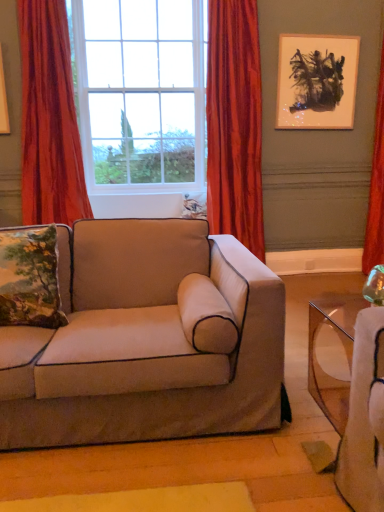
Measure the distance between point (381, 89) and camera.

They are 3.75 meters apart.

I want to click on red velvet curtain at right, the third curtain positioned from the left, so click(376, 188).

Is velvet orange curtain at left, which is the 3th curtain in right-to-left order, oriented away from velvet-like red curtain at center, which is the 2th curtain from right to left?

No, velvet orange curtain at left, which is the 3th curtain in right-to-left order, is not facing the opposite direction of velvet-like red curtain at center, which is the 2th curtain from right to left.

Considering the positions of objects velvet orange curtain at left, which is the 3th curtain in right-to-left order, and velvet-like red curtain at center, which is the 2th curtain from right to left, in the image provided, who is behind, velvet orange curtain at left, which is the 3th curtain in right-to-left order, or velvet-like red curtain at center, which is the 2th curtain from right to left,?

velvet-like red curtain at center, which is the 2th curtain from right to left, is further away from the camera.

Consider the image. From a real-world perspective, does velvet orange curtain at left, the 1th curtain positioned from the left, stand above velvet-like red curtain at center, positioned as the second curtain in left-to-right order?

Indeed, from a real-world perspective, velvet orange curtain at left, the 1th curtain positioned from the left, stands above velvet-like red curtain at center, positioned as the second curtain in left-to-right order.

Does red velvet curtain at right, the third curtain positioned from the left, turn towards velvet orange curtain at left, the 1th curtain positioned from the left?

No, red velvet curtain at right, the third curtain positioned from the left, does not turn towards velvet orange curtain at left, the 1th curtain positioned from the left.

Is the surface of red velvet curtain at right, which ranks as the 1th curtain in right-to-left order, in direct contact with velvet orange curtain at left, the 1th curtain positioned from the left?

red velvet curtain at right, which ranks as the 1th curtain in right-to-left order, and velvet orange curtain at left, the 1th curtain positioned from the left, are clearly separated.

Is red velvet curtain at right, the third curtain positioned from the left, wider or thinner than velvet orange curtain at left, the 1th curtain positioned from the left?

In the image, red velvet curtain at right, the third curtain positioned from the left, appears to be more narrow than velvet orange curtain at left, the 1th curtain positioned from the left.

Is point (378, 242) less distant than point (46, 23)?

That is False.

Which is in front, suede beige couch at center or velvet-like red curtain at center, which is the 2th curtain from right to left?

suede beige couch at center is closer to the camera.

From a real-world perspective, who is located lower, suede beige couch at center or velvet-like red curtain at center, positioned as the second curtain in left-to-right order?

suede beige couch at center is physically lower.

Visually, is suede beige couch at center positioned to the left or to the right of velvet-like red curtain at center, positioned as the second curtain in left-to-right order?

suede beige couch at center is positioned on velvet-like red curtain at center, positioned as the second curtain in left-to-right order,'s left side.

Is the surface of suede beige couch at center in direct contact with velvet-like red curtain at center, which is the 2th curtain from right to left?

No, suede beige couch at center is not making contact with velvet-like red curtain at center, which is the 2th curtain from right to left.

From a real-world perspective, is velvet orange curtain at left, which is the 3th curtain in right-to-left order, located beneath red velvet curtain at right, which ranks as the 1th curtain in right-to-left order?

No, from a real-world perspective, velvet orange curtain at left, which is the 3th curtain in right-to-left order, is not under red velvet curtain at right, which ranks as the 1th curtain in right-to-left order.

Can you confirm if velvet orange curtain at left, which is the 3th curtain in right-to-left order, is bigger than red velvet curtain at right, which ranks as the 1th curtain in right-to-left order?

Correct, velvet orange curtain at left, which is the 3th curtain in right-to-left order, is larger in size than red velvet curtain at right, which ranks as the 1th curtain in right-to-left order.

Is velvet orange curtain at left, which is the 3th curtain in right-to-left order, facing away from red velvet curtain at right, which ranks as the 1th curtain in right-to-left order?

No, velvet orange curtain at left, which is the 3th curtain in right-to-left order,'s orientation is not away from red velvet curtain at right, which ranks as the 1th curtain in right-to-left order.

Is velvet-like red curtain at center, which is the 2th curtain from right to left, turned away from red velvet curtain at right, which ranks as the 1th curtain in right-to-left order?

No.

Would you say red velvet curtain at right, which ranks as the 1th curtain in right-to-left order, is part of velvet-like red curtain at center, which is the 2th curtain from right to left,'s contents?

No, red velvet curtain at right, which ranks as the 1th curtain in right-to-left order, is not surrounded by velvet-like red curtain at center, which is the 2th curtain from right to left.

From the picture: From a real-world perspective, is velvet-like red curtain at center, positioned as the second curtain in left-to-right order, on top of red velvet curtain at right, the third curtain positioned from the left?

Correct, in the physical world, velvet-like red curtain at center, positioned as the second curtain in left-to-right order, is higher than red velvet curtain at right, the third curtain positioned from the left.

Does point (212, 127) lie in front of point (380, 105)?

That is True.

From the picture: Which of these two, clear glass window at center or matte black painting at upper right, is bigger?

With larger size is clear glass window at center.

From the image's perspective, between clear glass window at center and matte black painting at upper right, who is located below?

clear glass window at center appears lower in the image.

Based on the photo, does clear glass window at center come behind matte black painting at upper right?

No, it is in front of matte black painting at upper right.

Choose the correct answer: Is clear glass window at center inside matte black painting at upper right or outside it?

clear glass window at center is located beyond the bounds of matte black painting at upper right.

Is velvet-like red curtain at center, positioned as the second curtain in left-to-right order, oriented towards matte black painting at upper right?

No.

From the image's perspective, is velvet-like red curtain at center, which is the 2th curtain from right to left, beneath matte black painting at upper right?

Indeed, from the image's perspective, velvet-like red curtain at center, which is the 2th curtain from right to left, is shown beneath matte black painting at upper right.

Is velvet-like red curtain at center, which is the 2th curtain from right to left, not inside matte black painting at upper right?

Yes.

Who is bigger, velvet-like red curtain at center, which is the 2th curtain from right to left, or matte black painting at upper right?

With larger size is velvet-like red curtain at center, which is the 2th curtain from right to left.

Where is `curtain that is above the velvet-like red curtain at center, positioned as the second curtain in left-to-right order (from a real-world perspective)`? Image resolution: width=384 pixels, height=512 pixels. curtain that is above the velvet-like red curtain at center, positioned as the second curtain in left-to-right order (from a real-world perspective) is located at coordinates (49, 119).

Find the location of `curtain that is the 2nd one when counting rightward from the velvet orange curtain at left, the 1th curtain positioned from the left`. curtain that is the 2nd one when counting rightward from the velvet orange curtain at left, the 1th curtain positioned from the left is located at coordinates (376, 188).

When comparing their distances from embroidered fabric pillow at left, does velvet orange curtain at left, which is the 3th curtain in right-to-left order, or velvet-like red curtain at center, positioned as the second curtain in left-to-right order, seem closer?

The object closer to embroidered fabric pillow at left is velvet orange curtain at left, which is the 3th curtain in right-to-left order.

From the image, which object appears to be nearer to red velvet curtain at right, which ranks as the 1th curtain in right-to-left order, velvet orange curtain at left, the 1th curtain positioned from the left, or velvet-like red curtain at center, positioned as the second curtain in left-to-right order?

velvet-like red curtain at center, positioned as the second curtain in left-to-right order.

Based on their spatial positions, is suede beige couch at center or velvet orange curtain at left, the 1th curtain positioned from the left, further from clear glass window at center?

The object further to clear glass window at center is suede beige couch at center.

From the picture: Which object lies nearer to the anchor point red velvet curtain at right, the third curtain positioned from the left, matte black painting at upper right or clear glass window at center?

The object closer to red velvet curtain at right, the third curtain positioned from the left, is matte black painting at upper right.

Which object lies nearer to the anchor point suede beige couch at center, velvet orange curtain at left, which is the 3th curtain in right-to-left order, or velvet-like red curtain at center, positioned as the second curtain in left-to-right order?

velvet orange curtain at left, which is the 3th curtain in right-to-left order, is closer to suede beige couch at center.

Which object lies further to the anchor point velvet orange curtain at left, the 1th curtain positioned from the left, matte black painting at upper right or velvet-like red curtain at center, positioned as the second curtain in left-to-right order?

matte black painting at upper right.

Estimate the real-world distances between objects in this image. Which object is closer to clear glass window at center, embroidered fabric pillow at left or suede beige couch at center?

suede beige couch at center is positioned closer to the anchor clear glass window at center.

Looking at the image, which one is located further to suede beige couch at center, velvet orange curtain at left, the 1th curtain positioned from the left, or matte black painting at upper right?

matte black painting at upper right lies further to suede beige couch at center than the other object.

What are the coordinates of `window positioned between suede beige couch at center and matte black painting at upper right from near to far` in the screenshot? It's located at (141, 93).

The image size is (384, 512). I want to click on pillow between suede beige couch at center and velvet-like red curtain at center, which is the 2th curtain from right to left, in the front-back direction, so click(30, 278).

Where is `curtain between velvet orange curtain at left, the 1th curtain positioned from the left, and red velvet curtain at right, which ranks as the 1th curtain in right-to-left order, from left to right`? This screenshot has width=384, height=512. curtain between velvet orange curtain at left, the 1th curtain positioned from the left, and red velvet curtain at right, which ranks as the 1th curtain in right-to-left order, from left to right is located at coordinates (235, 123).

Locate an element on the screen. pillow between velvet orange curtain at left, the 1th curtain positioned from the left, and red velvet curtain at right, the third curtain positioned from the left is located at coordinates (30, 278).